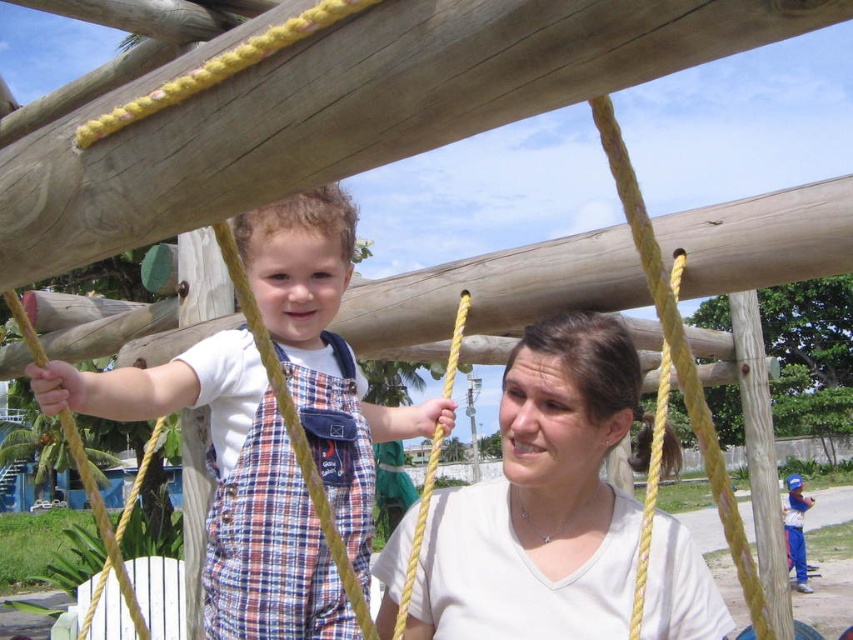
You are standing at the point with coordinates point [225,524] and want to walk to the point with coordinates point [347,445]. According to the scene, will you have to walk forward or backward to reach your destination?

The point [347,445] is behind point [225,524], so you will have to walk backward to reach your destination.

You are a photographer trying to capture a candid shot of the white matte shirt at center and the blue denim pants at lower right. Since you want both subjects to be clearly visible in the frame, which one should you adjust your camera focus to prioritize based on their sizes?

The white matte shirt at center is wider than the blue denim pants at lower right, so prioritize focusing on the white matte shirt at center to ensure both fit clearly in the frame.

You are a photographer trying to capture a candid shot of both the plaid overalls at center and the blue denim pants at lower right in the playground scene. Based on their positions, which object should you focus on first to ensure both are in frame?

The plaid overalls at center is to the left of blue denim pants at lower right, so you should focus on the plaid overalls at center first to ensure both are in frame.